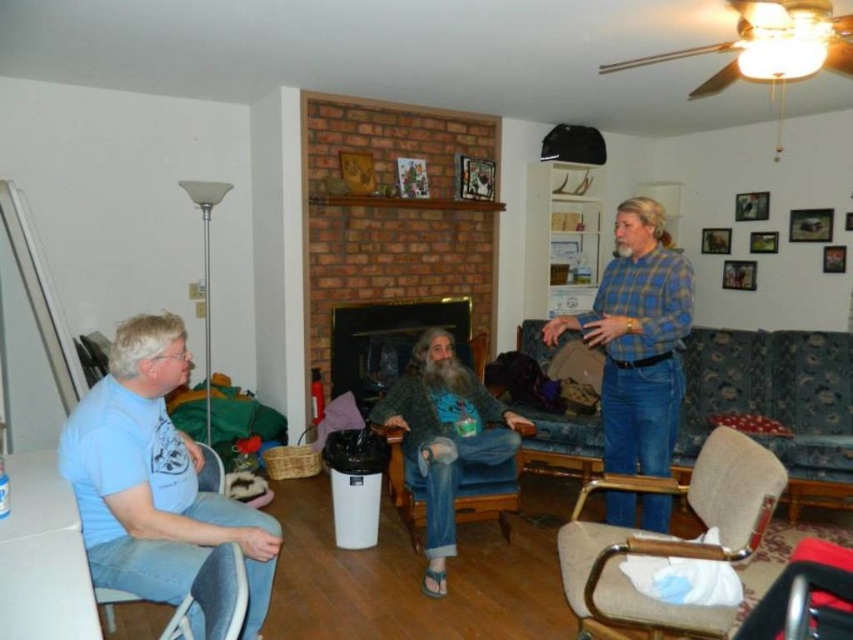
Question: Can you confirm if blue plaid shirt at right is positioned above blue fabric armchair at center?

Choices:
 (A) yes
 (B) no

Answer: (A)

Question: Estimate the real-world distances between objects in this image. Which object is farther from the light blue t-shirt at left?

Choices:
 (A) blue fabric armchair at center
 (B) brick fireplace at center
 (C) blue plaid shirt at right
 (D) beige fabric chair at lower right

Answer: (B)

Question: Is blue floral fabric couch at center above blue fabric armchair at center?

Choices:
 (A) yes
 (B) no

Answer: (A)

Question: Among these points, which one is nearest to the camera?

Choices:
 (A) (107, 524)
 (B) (479, 456)

Answer: (A)

Question: Which object is farther from the camera taking this photo?

Choices:
 (A) denim fabric armchair at left
 (B) blue floral fabric couch at center
 (C) beige fabric chair at lower right

Answer: (B)

Question: Is blue plaid shirt at right positioned in front of beige fabric chair at lower right?

Choices:
 (A) no
 (B) yes

Answer: (A)